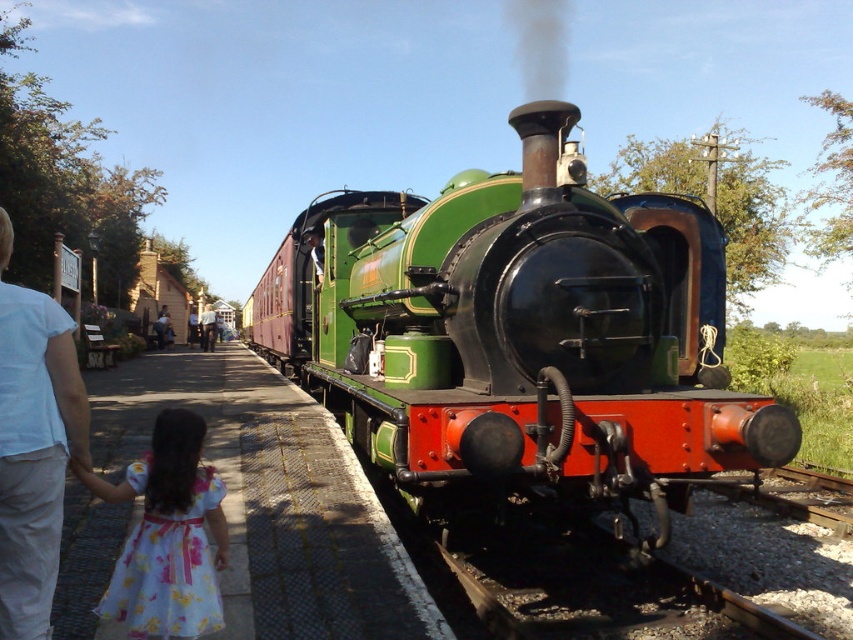
You are a photographer standing at the railway station and want to take a photo of the white cotton shirt at left and the light brown wooden sign at center. Which object should you zoom in more on to capture both in focus?

The white cotton shirt at left is smaller than the light brown wooden sign at center, so you should zoom in more on the light brown wooden sign at center to ensure both are in focus.